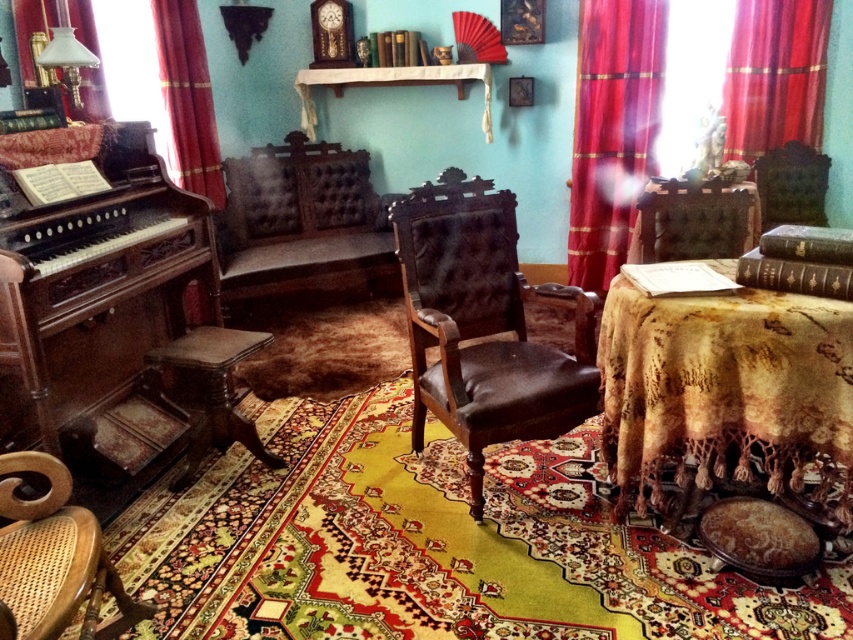
Question: Which point appears closest to the camera in this image?

Choices:
 (A) (616, 205)
 (B) (4, 243)
 (C) (756, 35)
 (D) (482, 308)

Answer: (B)

Question: Does red velvet curtain at right have a larger size compared to red velvet curtain at upper right?

Choices:
 (A) no
 (B) yes

Answer: (B)

Question: Which point appears farthest from the camera in this image?

Choices:
 (A) (221, 173)
 (B) (93, 282)
 (C) (224, 362)
 (D) (421, 220)

Answer: (A)

Question: Considering the real-world distances, which object is closest to the woven cane armchair at lower left?

Choices:
 (A) red velvet curtain at right
 (B) red velvet curtain at left
 (C) polished dark wood piano at left
 (D) brown leather armchair at center

Answer: (C)

Question: In this image, where is woven cane armchair at lower left located relative to red velvet curtain at left?

Choices:
 (A) above
 (B) below

Answer: (B)

Question: Is polished dark wood piano at left closer to the viewer compared to brown leather armchair at center?

Choices:
 (A) no
 (B) yes

Answer: (B)